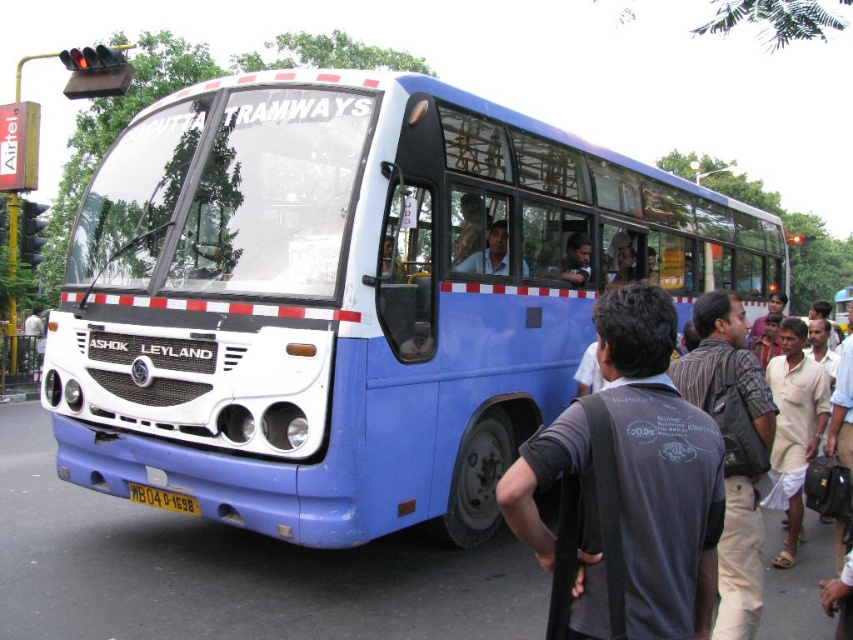
Does dark gray fabric vest at center appear over matte blue shirt at center?

No.

Who is more forward, (643, 346) or (479, 259)?

Point (643, 346) is in front.

What do you see at coordinates (659, 468) in the screenshot?
I see `dark gray fabric vest at center` at bounding box center [659, 468].

This screenshot has width=853, height=640. I want to click on dark gray fabric vest at center, so click(x=659, y=468).

Who is taller, dark gray fabric vest at center or dark blue shirt at center?

dark gray fabric vest at center

Who is positioned more to the left, dark gray fabric vest at center or dark blue shirt at center?

From the viewer's perspective, dark gray fabric vest at center appears more on the left side.

Which is in front, point (576, 401) or point (566, 264)?

Point (576, 401) is in front.

Locate an element on the screen. Image resolution: width=853 pixels, height=640 pixels. dark gray fabric vest at center is located at coordinates (659, 468).

Does blue matte bus at center appear on the right side of dark blue shirt at center?

Incorrect, blue matte bus at center is not on the right side of dark blue shirt at center.

Is point (408, 465) positioned before point (564, 276)?

Yes.

Locate an element on the screen. blue matte bus at center is located at coordinates (352, 298).